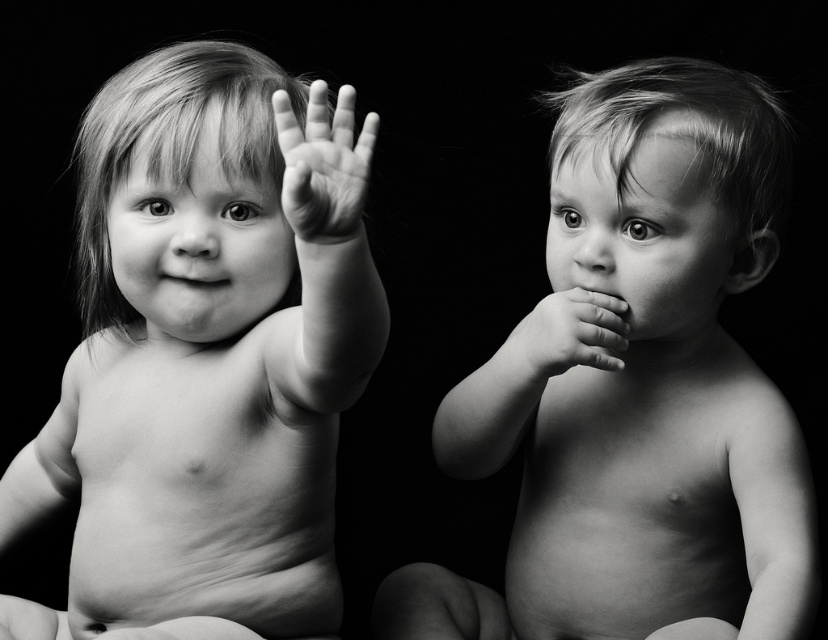
Question: Based on their relative distances, which object is farther from the smooth skin hand at center?

Choices:
 (A) smooth skin baby at center
 (B) smooth matte mouth at center
 (C) smooth skin hand at center right
 (D) smooth skin baby at left

Answer: (A)

Question: Considering the real-world distances, which object is farthest from the smooth skin hand at center?

Choices:
 (A) smooth skin hand at center right
 (B) smooth skin baby at center
 (C) smooth matte mouth at center

Answer: (B)

Question: Can you confirm if smooth skin hand at center right is bigger than smooth matte mouth at center?

Choices:
 (A) yes
 (B) no

Answer: (A)

Question: Is smooth skin baby at center to the right of smooth matte mouth at center from the viewer's perspective?

Choices:
 (A) no
 (B) yes

Answer: (B)

Question: Does smooth skin baby at left have a smaller size compared to smooth matte mouth at center?

Choices:
 (A) no
 (B) yes

Answer: (A)

Question: Which of the following is the farthest from the observer?

Choices:
 (A) smooth skin hand at center
 (B) smooth skin baby at left
 (C) smooth skin baby at center
 (D) smooth skin hand at center right

Answer: (C)